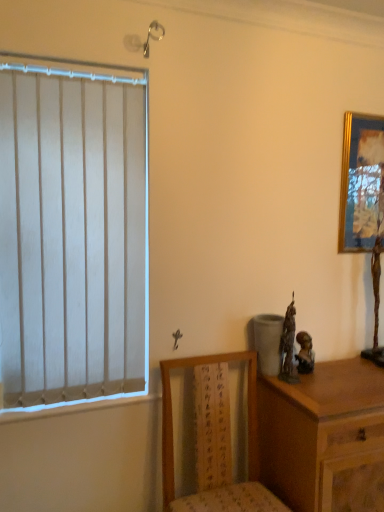
Where is `free point to the right of matte bronze statue at right`? The height and width of the screenshot is (512, 384). free point to the right of matte bronze statue at right is located at coordinates (352, 373).